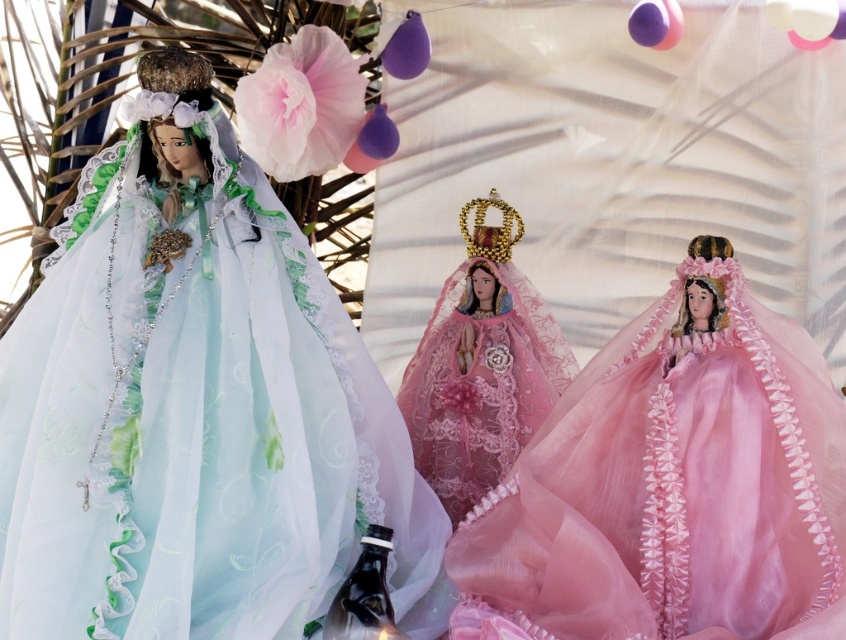
Is point (305, 419) farther from viewer compared to point (662, 536)?

Yes.

You are a GUI agent. You are given a task and a screenshot of the screen. Output one action in this format:
    pyautogui.click(x=<x>, y=<y>)
    Task: Click on the matte green tulle dress at left
    The width and height of the screenshot is (846, 640).
    Given the screenshot: What is the action you would take?
    pyautogui.click(x=195, y=406)

Is point (116, 522) closer to viewer compared to point (607, 384)?

Yes.

Identify the location of matte green tulle dress at left. The image size is (846, 640). (195, 406).

Does matte green tulle dress at left have a lesser width compared to pink lace dress at center?

In fact, matte green tulle dress at left might be wider than pink lace dress at center.

Who is more distant from viewer, (81, 440) or (530, 330)?

Point (530, 330)

What do you see at coordinates (195, 406) in the screenshot? I see `matte green tulle dress at left` at bounding box center [195, 406].

I want to click on matte green tulle dress at left, so click(x=195, y=406).

Is pink tulle dress at center positioned at the back of pink lace dress at center?

No, it is not.

Can you confirm if pink tulle dress at center is smaller than pink lace dress at center?

No, pink tulle dress at center is not smaller than pink lace dress at center.

Identify the location of pink tulle dress at center. The height and width of the screenshot is (640, 846). (669, 483).